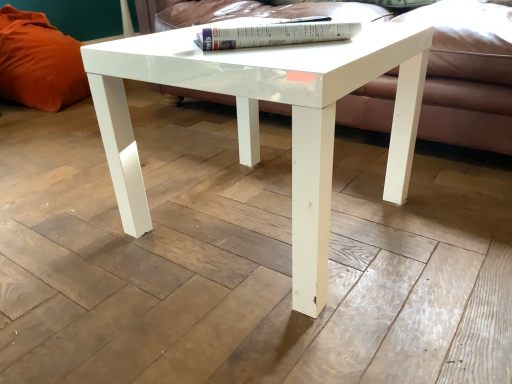
Question: Considering the positions of white glossy coffee table at center and white glossy book at upper center in the image, is white glossy coffee table at center wider or thinner than white glossy book at upper center?

Choices:
 (A) wide
 (B) thin

Answer: (A)

Question: Relative to white glossy book at upper center, is white glossy coffee table at center in front or behind?

Choices:
 (A) behind
 (B) front

Answer: (B)

Question: Which of these objects is positioned closest to the white glossy book at upper center?

Choices:
 (A) orange fabric pillow at left
 (B) white glossy coffee table at center
 (C) matte white couch at center

Answer: (B)

Question: Which of these objects is positioned farthest from the matte white couch at center?

Choices:
 (A) white glossy coffee table at center
 (B) white glossy book at upper center
 (C) orange fabric pillow at left

Answer: (C)